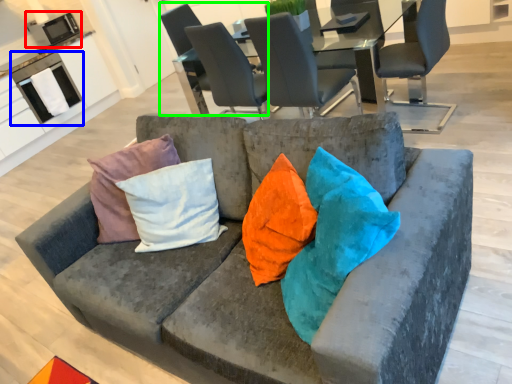
Question: Based on their relative distances, which object is farther from appliance (highlighted by a red box)? Choose from appliance (highlighted by a blue box) and chair (highlighted by a green box).

Choices:
 (A) appliance
 (B) chair

Answer: (B)